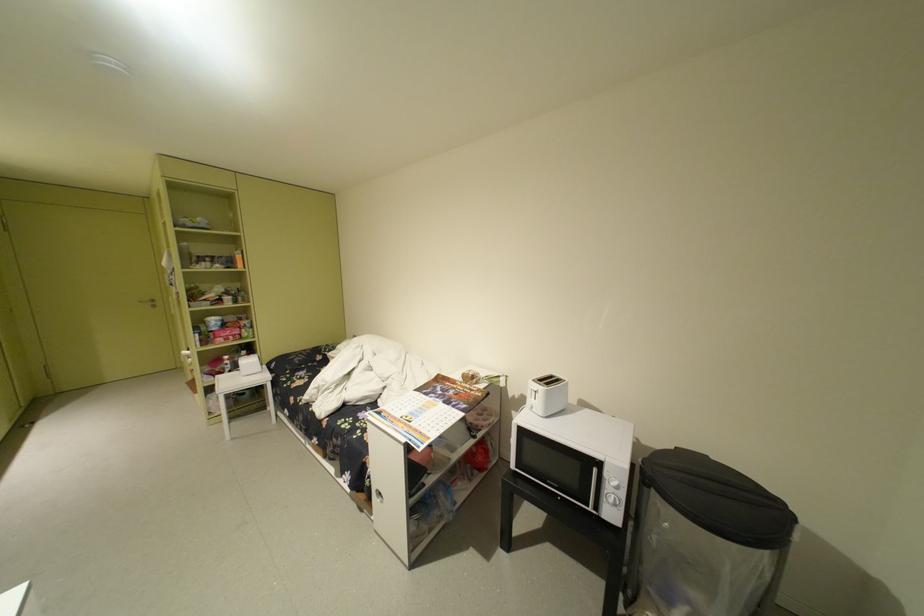
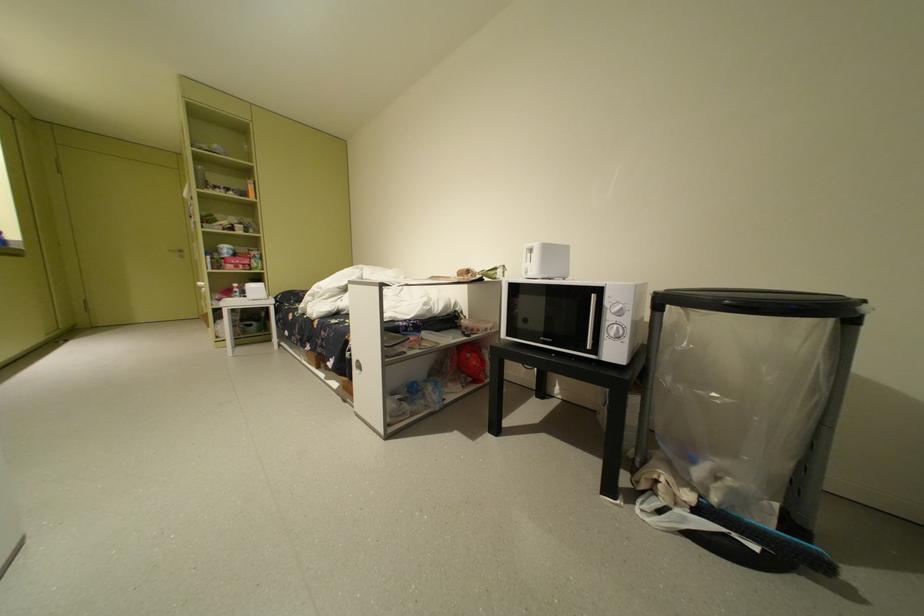
Which direction would the cameraman need to move to produce the second image?

The movement direction of the cameraman is right, forward.